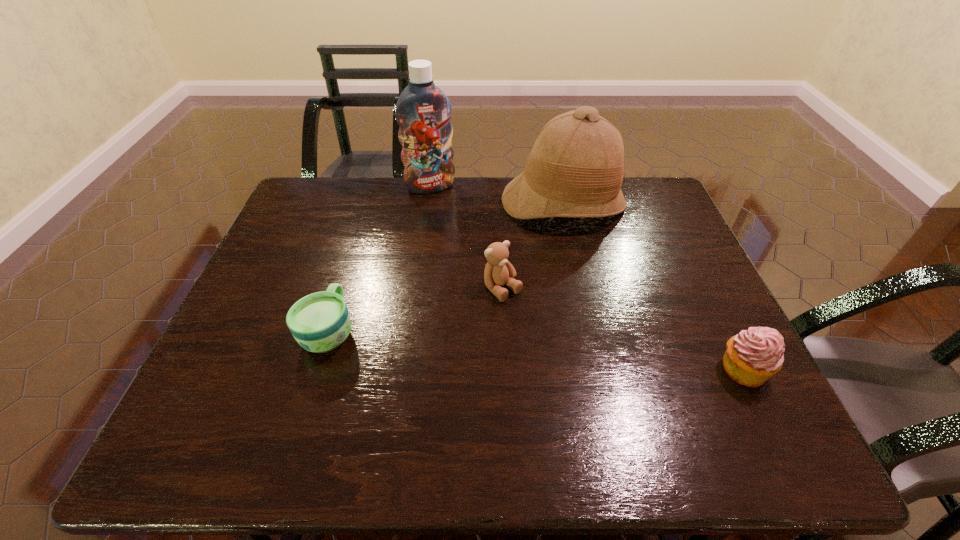
Where is `free space on the desktop that is between the shortest object and the rightmost object and is positioned on the front-facing side of the teddy bear`? free space on the desktop that is between the shortest object and the rightmost object and is positioned on the front-facing side of the teddy bear is located at coordinates (566, 353).

Where is `free space on the desktop that is between the leftmost object and the cupcake and is positioned on the front-facing side of the hat`? This screenshot has height=540, width=960. free space on the desktop that is between the leftmost object and the cupcake and is positioned on the front-facing side of the hat is located at coordinates (585, 354).

The image size is (960, 540). I want to click on vacant space on the desktop that is between the cup and the rightmost object and is positioned on the front label of the shampoo, so click(502, 347).